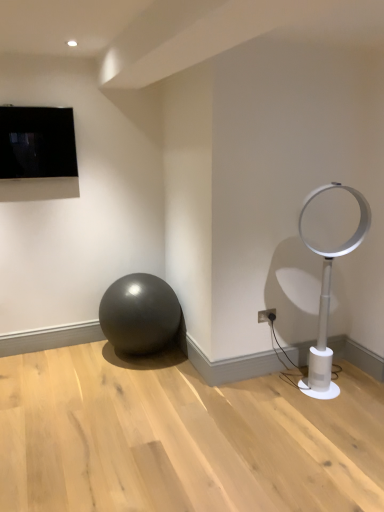
The height and width of the screenshot is (512, 384). What do you see at coordinates (267, 315) in the screenshot? I see `white plastic electric outlet at lower right` at bounding box center [267, 315].

What are the coordinates of `black glossy tv at upper left` in the screenshot? It's located at (37, 142).

Is white plastic fan at right directly adjacent to black glossy tv at upper left?

white plastic fan at right and black glossy tv at upper left are clearly separated.

Considering the positions of point (337, 185) and point (59, 122), is point (337, 185) closer or farther from the camera than point (59, 122)?

Point (337, 185).

Considering the relative positions of white plastic fan at right and black glossy tv at upper left in the image provided, is white plastic fan at right to the left of black glossy tv at upper left from the viewer's perspective?

No, white plastic fan at right is not to the left of black glossy tv at upper left.

Does black glossy tv at upper left turn towards glossy metallic ball at lower left?

No, black glossy tv at upper left is not facing towards glossy metallic ball at lower left.

From a real-world perspective, who is located lower, black glossy tv at upper left or glossy metallic ball at lower left?

glossy metallic ball at lower left, from a real-world perspective.

Between black glossy tv at upper left and glossy metallic ball at lower left, which one has larger size?

glossy metallic ball at lower left is bigger.

From the image's perspective, does black glossy tv at upper left appear higher than glossy metallic ball at lower left?

Yes, from the image's perspective, black glossy tv at upper left is over glossy metallic ball at lower left.

Which of these two, glossy metallic ball at lower left or black glossy tv at upper left, stands taller?

With more height is glossy metallic ball at lower left.

Find the location of a particular element. ball below the black glossy tv at upper left (from a real-world perspective) is located at coordinates (139, 314).

In the scene shown: Which is closer to the camera, (159,309) or (15,176)?

Point (159,309) is positioned farther from the camera compared to point (15,176).

Is glossy metallic ball at lower left not near black glossy tv at upper left?

Yes, glossy metallic ball at lower left is far from black glossy tv at upper left.

From a real-world perspective, is white plastic fan at right physically above glossy metallic ball at lower left?

Yes, from a real-world perspective, white plastic fan at right is over glossy metallic ball at lower left

You are a GUI agent. You are given a task and a screenshot of the screen. Output one action in this format:
    pyautogui.click(x=<x>, y=<y>)
    Task: Click on the lamp in front of the glossy metallic ball at lower left
    
    Given the screenshot: What is the action you would take?
    pyautogui.click(x=332, y=258)

Is white plastic fan at right in contact with glossy metallic ball at lower left?

They are not placed beside each other.

How many degrees apart are the facing directions of white plastic fan at right and glossy metallic ball at lower left?

white plastic fan at right and glossy metallic ball at lower left are facing 19.9 degrees away from each other.

Where is `lamp to the right of glossy metallic ball at lower left`? The width and height of the screenshot is (384, 512). lamp to the right of glossy metallic ball at lower left is located at coordinates (332, 258).

From a real-world perspective, is glossy metallic ball at lower left positioned over white plastic fan at right based on gravity?

No, from a real-world perspective, glossy metallic ball at lower left is not on top of white plastic fan at right.

Is there a large distance between glossy metallic ball at lower left and white plastic fan at right?

glossy metallic ball at lower left is far away from white plastic fan at right.

Can you confirm if black glossy tv at upper left is positioned to the left of white plastic electric outlet at lower right?

Correct, you'll find black glossy tv at upper left to the left of white plastic electric outlet at lower right.

Looking at this image, in the image, is black glossy tv at upper left positioned in front of or behind white plastic electric outlet at lower right?

Clearly, black glossy tv at upper left is in front of white plastic electric outlet at lower right.

From a real-world perspective, which is physically below, black glossy tv at upper left or white plastic electric outlet at lower right?

white plastic electric outlet at lower right is physically lower.

The height and width of the screenshot is (512, 384). I want to click on electric outlet below the black glossy tv at upper left (from the image's perspective), so click(267, 315).

Is white plastic electric outlet at lower right wider than white plastic fan at right?

Incorrect, the width of white plastic electric outlet at lower right does not surpass that of white plastic fan at right.

Is white plastic electric outlet at lower right far from white plastic fan at right?

white plastic electric outlet at lower right is near white plastic fan at right, not far away.

Is white plastic electric outlet at lower right to the left of white plastic fan at right from the viewer's perspective?

Yes.

How much distance is there between white plastic electric outlet at lower right and white plastic fan at right?

white plastic electric outlet at lower right is 23.67 inches away from white plastic fan at right.

What are the coordinates of `lamp lying in front of the black glossy tv at upper left` in the screenshot? It's located at (332, 258).

Where is `ball below the black glossy tv at upper left (from the image's perspective)`? ball below the black glossy tv at upper left (from the image's perspective) is located at coordinates (139, 314).

From the image, which object appears to be farther from black glossy tv at upper left, white plastic electric outlet at lower right or glossy metallic ball at lower left?

white plastic electric outlet at lower right is further to black glossy tv at upper left.

Which object lies nearer to the anchor point white plastic fan at right, black glossy tv at upper left or glossy metallic ball at lower left?

glossy metallic ball at lower left lies closer to white plastic fan at right than the other object.

Based on their spatial positions, is white plastic electric outlet at lower right or white plastic fan at right further from black glossy tv at upper left?

white plastic electric outlet at lower right lies further to black glossy tv at upper left than the other object.

From the image, which object appears to be farther from glossy metallic ball at lower left, white plastic electric outlet at lower right or black glossy tv at upper left?

Among the two, black glossy tv at upper left is located further to glossy metallic ball at lower left.

Estimate the real-world distances between objects in this image. Which object is further from white plastic electric outlet at lower right, white plastic fan at right or black glossy tv at upper left?

The object further to white plastic electric outlet at lower right is black glossy tv at upper left.

From the image, which object appears to be farther from white plastic electric outlet at lower right, black glossy tv at upper left or glossy metallic ball at lower left?

The object further to white plastic electric outlet at lower right is black glossy tv at upper left.

Estimate the real-world distances between objects in this image. Which object is closer to white plastic electric outlet at lower right, glossy metallic ball at lower left or black glossy tv at upper left?

The object closer to white plastic electric outlet at lower right is glossy metallic ball at lower left.

Which object lies further to the anchor point black glossy tv at upper left, glossy metallic ball at lower left or white plastic electric outlet at lower right?

white plastic electric outlet at lower right is further to black glossy tv at upper left.

This screenshot has height=512, width=384. What are the coordinates of `ball between black glossy tv at upper left and white plastic fan at right in the horizontal direction` in the screenshot? It's located at (139, 314).

Find the location of a particular element. This screenshot has height=512, width=384. electric outlet between glossy metallic ball at lower left and white plastic fan at right from left to right is located at coordinates (267, 315).

Locate an element on the screen. ball between black glossy tv at upper left and white plastic electric outlet at lower right in the horizontal direction is located at coordinates (139, 314).

What are the coordinates of `electric outlet situated between black glossy tv at upper left and white plastic fan at right from left to right` in the screenshot? It's located at (267, 315).